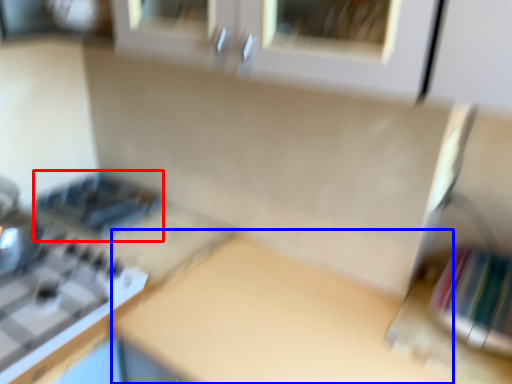
Question: Which object is further to the camera taking this photo, appliance (highlighted by a red box) or counter top (highlighted by a blue box)?

Choices:
 (A) appliance
 (B) counter top

Answer: (A)